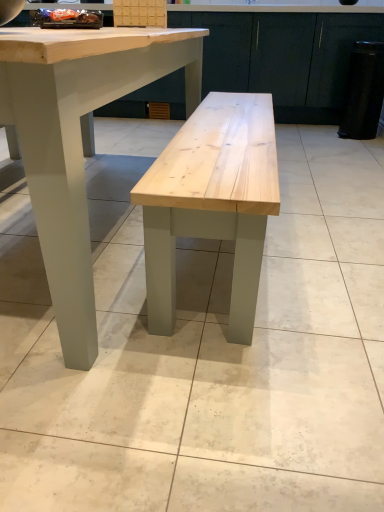
Question: From a real-world perspective, is matte wood cabinet at center positioned over natural wood table at center based on gravity?

Choices:
 (A) no
 (B) yes

Answer: (B)

Question: Is matte wood cabinet at center next to natural wood table at center?

Choices:
 (A) yes
 (B) no

Answer: (B)

Question: Is matte wood cabinet at center in front of natural wood table at center?

Choices:
 (A) yes
 (B) no

Answer: (B)

Question: Can you confirm if matte wood cabinet at center is positioned to the left of natural wood table at center?

Choices:
 (A) yes
 (B) no

Answer: (B)

Question: Can you confirm if matte wood cabinet at center is shorter than natural wood table at center?

Choices:
 (A) yes
 (B) no

Answer: (B)

Question: Can you confirm if matte wood cabinet at center is positioned to the right of natural wood table at center?

Choices:
 (A) no
 (B) yes

Answer: (B)

Question: Is natural wood table at center aimed at matte wood cabinet at center?

Choices:
 (A) yes
 (B) no

Answer: (A)

Question: Is natural wood table at center smaller than matte wood cabinet at center?

Choices:
 (A) yes
 (B) no

Answer: (B)

Question: Is natural wood table at center taller than matte wood cabinet at center?

Choices:
 (A) no
 (B) yes

Answer: (A)

Question: From a real-world perspective, is natural wood table at center under matte wood cabinet at center?

Choices:
 (A) no
 (B) yes

Answer: (B)

Question: Can you confirm if natural wood table at center is thinner than matte wood cabinet at center?

Choices:
 (A) no
 (B) yes

Answer: (A)

Question: From the image's perspective, would you say natural wood table at center is shown under matte wood cabinet at center?

Choices:
 (A) no
 (B) yes

Answer: (B)

Question: Considering the positions of point (223, 14) and point (69, 48), is point (223, 14) closer or farther from the camera than point (69, 48)?

Choices:
 (A) closer
 (B) farther

Answer: (B)